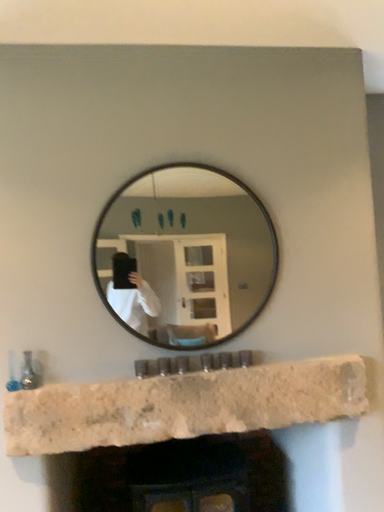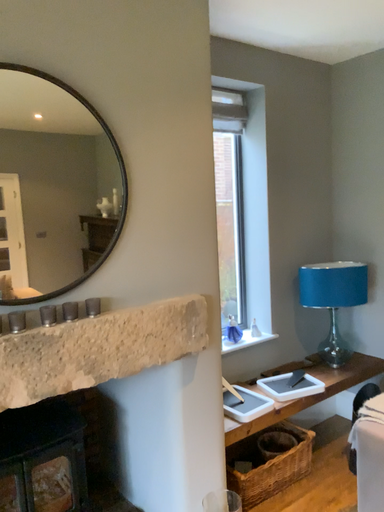
Question: How did the camera likely rotate when shooting the video?

Choices:
 (A) rotated right
 (B) rotated left

Answer: (A)